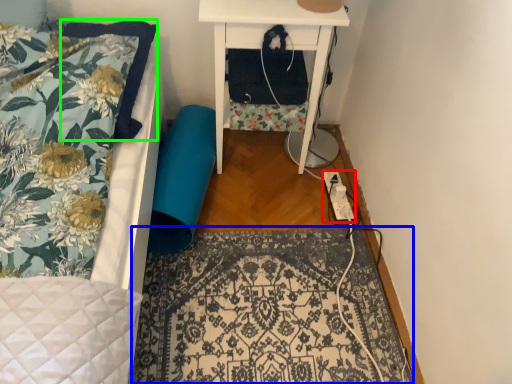
Question: Considering the real-world distances, which object is farthest from extension cord (highlighted by a red box)? mat (highlighted by a blue box) or pillow (highlighted by a green box)?

Choices:
 (A) mat
 (B) pillow

Answer: (B)